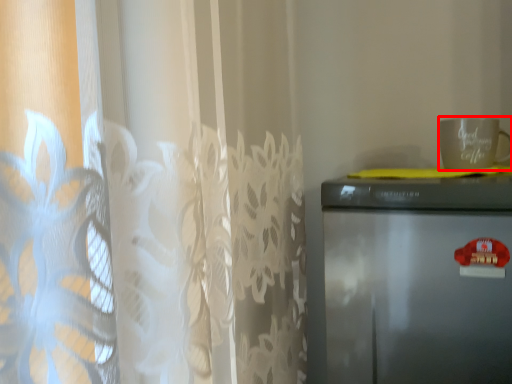
Question: Observing the image, what is the correct spatial positioning of mug (annotated by the red box) in reference to refrigerator?

Choices:
 (A) right
 (B) left

Answer: (A)